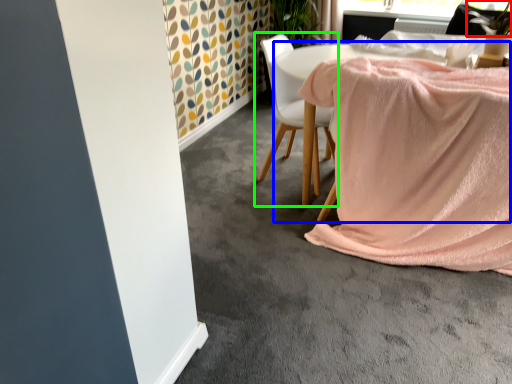
Question: Estimate the real-world distances between objects in this image. Which object is farther from plant (highlighted by a red box), table (highlighted by a blue box) or chair (highlighted by a green box)?

Choices:
 (A) table
 (B) chair

Answer: (B)